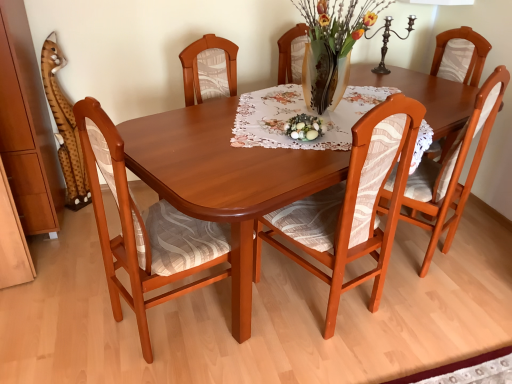
Find the location of a particular element. This screenshot has width=512, height=384. vacant area located to the right-hand side of wooden chair at left, which is the 3th chair from right to left is located at coordinates (274, 339).